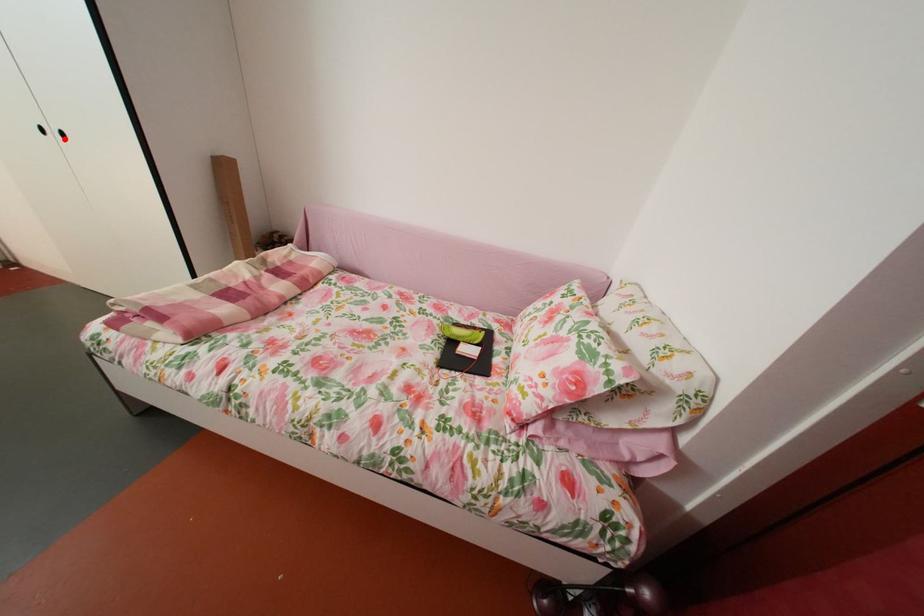
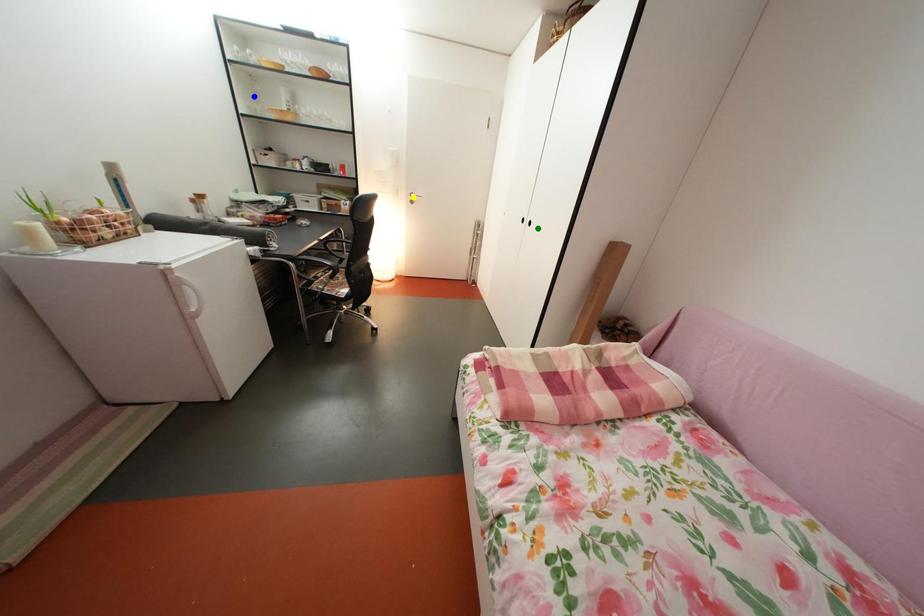
Question: I am providing you with two images of the same scene from different viewpoints. A red point is marked on the first image. You are given multiple points on the second image. Which point in image 2 is actually the same real-world point as the red point in image 1?

Choices:
 (A) green point
 (B) yellow point
 (C) blue point

Answer: (A)